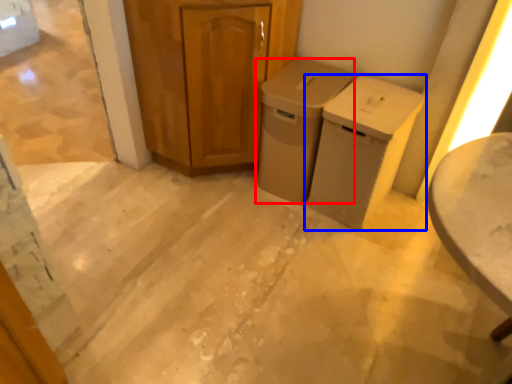
Question: Among these objects, which one is farthest to the camera, waste container (highlighted by a red box) or waste container (highlighted by a blue box)?

Choices:
 (A) waste container
 (B) waste container

Answer: (A)